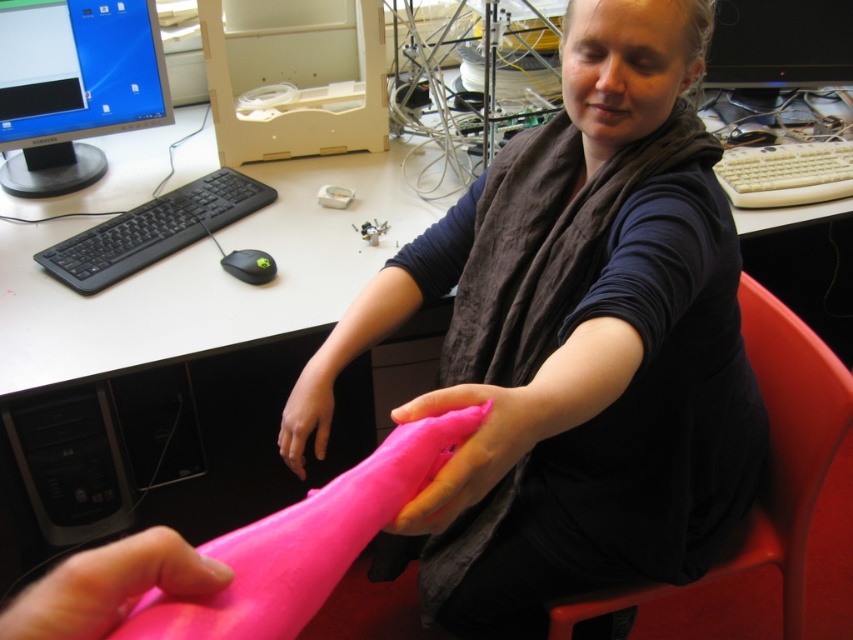
Question: Which point is closer to the camera?

Choices:
 (A) black glossy monitor at upper right
 (B) beige plastic keyboard at upper right

Answer: (B)

Question: Is white plastic computer desk at center closer to the viewer compared to pink rubber finger at center?

Choices:
 (A) yes
 (B) no

Answer: (B)

Question: Is matte black monitor at upper left bigger than pink matte/silky fabric at center?

Choices:
 (A) yes
 (B) no

Answer: (A)

Question: Among these points, which one is farthest from the camera?

Choices:
 (A) (114, 259)
 (B) (850, 64)

Answer: (B)

Question: Among these points, which one is nearest to the camera?

Choices:
 (A) (111, 593)
 (B) (532, 400)
 (C) (616, 211)
 (D) (341, 298)

Answer: (A)

Question: Does matte black monitor at upper left appear on the right side of beige plastic keyboard at upper right?

Choices:
 (A) yes
 (B) no

Answer: (B)